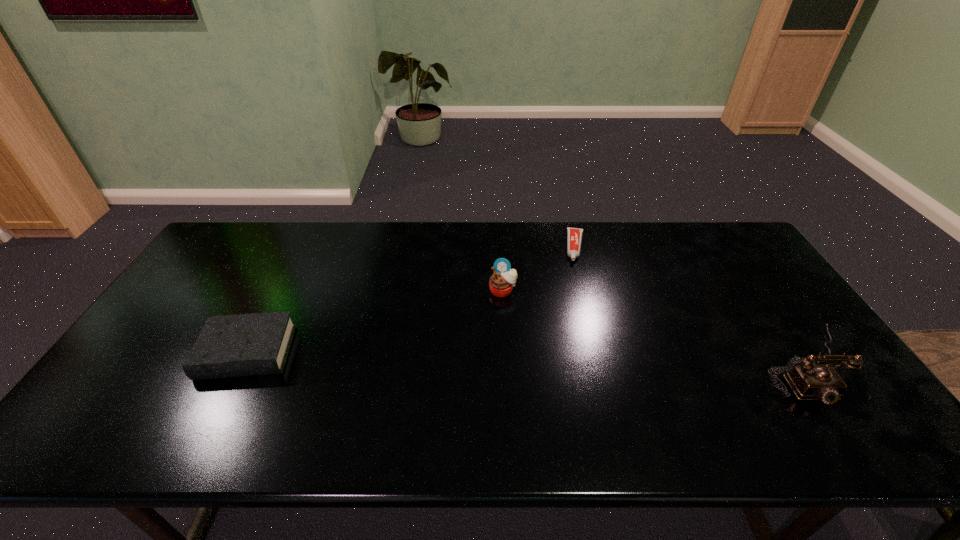
What are the coordinates of `the leftmost object` in the screenshot? It's located at (252, 344).

Identify the location of the second shortest object. (252, 344).

Locate an element on the screen. The width and height of the screenshot is (960, 540). telephone is located at coordinates (809, 381).

The width and height of the screenshot is (960, 540). What are the coordinates of `the farthest object` in the screenshot? It's located at (574, 235).

Where is `the shortest object`? The width and height of the screenshot is (960, 540). the shortest object is located at coordinates (574, 235).

At what (x,y) coordinates should I click in order to perform the action: click on the third object from right to left. Please return your answer as a coordinate pair (x, y). The width and height of the screenshot is (960, 540). Looking at the image, I should click on (503, 279).

The height and width of the screenshot is (540, 960). Find the location of `muffin`. muffin is located at coordinates (503, 279).

I want to click on free region located on the right of the leftmost object, so [360, 353].

Find the location of a particular element. This screenshot has height=540, width=960. vacant region located at the nozzle of the toothpaste is located at coordinates (573, 353).

Find the location of a particular element. The height and width of the screenshot is (540, 960). vacant area located at the nozzle of the toothpaste is located at coordinates (574, 336).